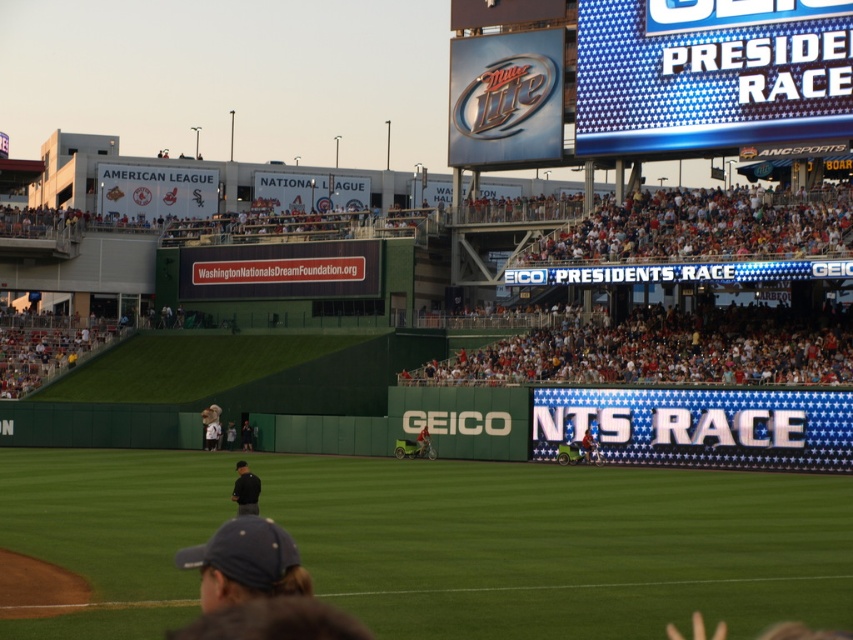
Question: Which point is farther to the camera?

Choices:
 (A) (209, 435)
 (B) (219, 497)
 (C) (782, 3)
 (D) (228, 429)

Answer: (D)

Question: Is red fabric crowd at upper right below dark blue uniform at center?

Choices:
 (A) yes
 (B) no

Answer: (B)

Question: Which object is closer to the camera taking this photo?

Choices:
 (A) dark blue uniform at center
 (B) dark blue fabric cap at lower center

Answer: (B)

Question: Can you confirm if blue led scoreboard at upper right is thinner than black uniform at center?

Choices:
 (A) no
 (B) yes

Answer: (A)

Question: Which of the following is the closest to the observer?

Choices:
 (A) (175, 554)
 (B) (248, 422)
 (C) (227, 438)
 (D) (766, 100)

Answer: (A)

Question: Does dark blue fabric cap at lower center have a smaller size compared to white fabric person at lower left?

Choices:
 (A) no
 (B) yes

Answer: (A)